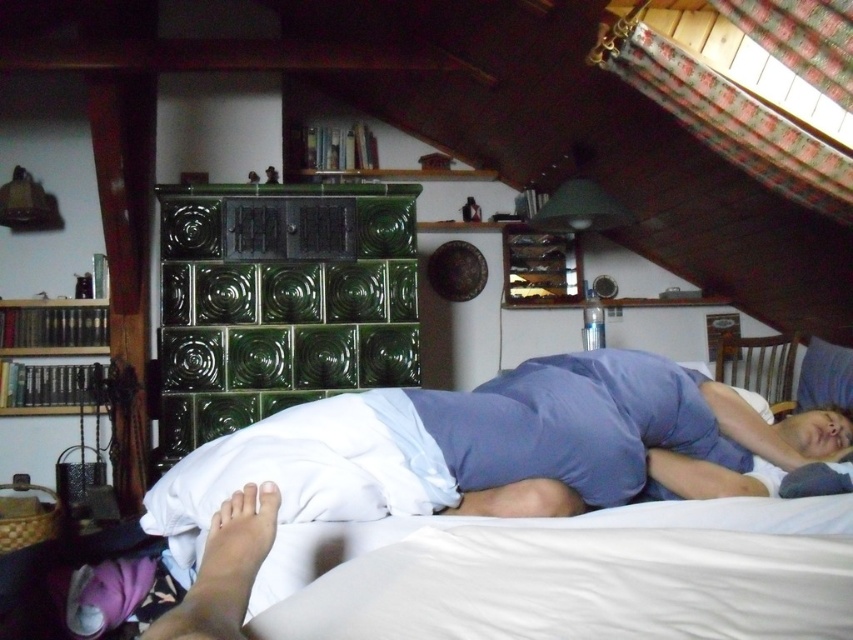
Is white soft bed at lower center shorter than dark brown wooden bookshelf at left?

Indeed, white soft bed at lower center has a lesser height compared to dark brown wooden bookshelf at left.

Is white soft bed at lower center thinner than dark brown wooden bookshelf at left?

No.

Is point (151, 493) positioned before point (21, 381)?

Yes.

Identify the location of white soft bed at lower center. The image size is (853, 640). (485, 454).

Is white soft bed at lower center below white soft foot at lower left?

No, white soft bed at lower center is not below white soft foot at lower left.

Can you confirm if white soft bed at lower center is shorter than white soft foot at lower left?

No.

Between point (218, 612) and point (265, 548), which one is positioned in front?

Point (218, 612) is in front.

Locate an element on the screen. This screenshot has width=853, height=640. white soft bed at lower center is located at coordinates (485, 454).

Image resolution: width=853 pixels, height=640 pixels. I want to click on dark brown wooden bookshelf at left, so click(49, 355).

Is dark brown wooden bookshelf at left positioned in front of white soft foot at lower left?

No.

Is point (70, 336) positioned before point (212, 532)?

No, it is behind (212, 532).

The height and width of the screenshot is (640, 853). What are the coordinates of `dark brown wooden bookshelf at left` in the screenshot? It's located at (49, 355).